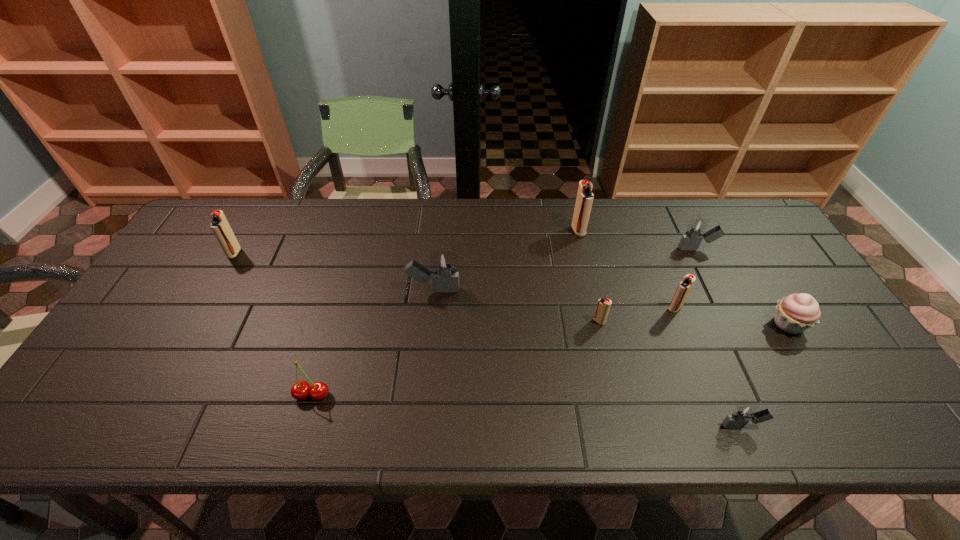
In the image, there is a desktop. Find the location of `free region at the far edge`. free region at the far edge is located at coordinates (489, 212).

In the image, there is a desktop. Identify the location of vacant space at the near edge. (534, 408).

Where is `free space at the left edge`? Image resolution: width=960 pixels, height=540 pixels. free space at the left edge is located at coordinates (162, 285).

The height and width of the screenshot is (540, 960). In the image, there is a desktop. Identify the location of vacant space at the right edge. (784, 266).

Locate an element on the screen. Image resolution: width=960 pixels, height=540 pixels. free space at the far right corner is located at coordinates (741, 219).

Locate an element on the screen. The image size is (960, 540). free space between the third object from left to right and the second biggest red igniter is located at coordinates (334, 272).

Identify the location of unoccupied position between the rightmost object and the nearest red igniter. (693, 323).

Find the location of `empty space that is in between the farthest gray igniter and the leftmost red igniter`. empty space that is in between the farthest gray igniter and the leftmost red igniter is located at coordinates (466, 251).

Where is `free point between the sixth igniter from right to left and the cherry`? The height and width of the screenshot is (540, 960). free point between the sixth igniter from right to left and the cherry is located at coordinates (373, 342).

The width and height of the screenshot is (960, 540). What are the coordinates of `empty space between the nearest gray igniter and the second igniter from left to right` in the screenshot? It's located at (588, 358).